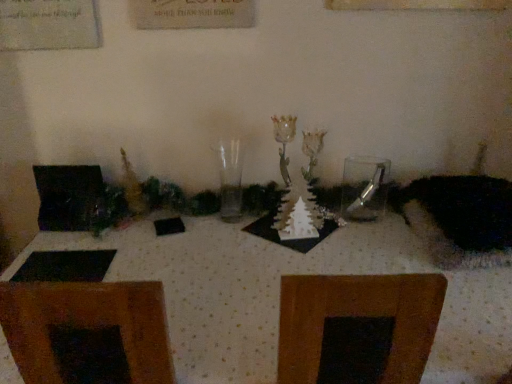
In order to click on transparent glass vase at center in this screenshot , I will do `click(230, 179)`.

Describe the element at coordinates (230, 179) in the screenshot. The width and height of the screenshot is (512, 384). I see `transparent glass vase at center` at that location.

What is the approximate height of fuzzy black cat at right?

It is 8.55 inches.

The height and width of the screenshot is (384, 512). Identify the location of white dotted fabric at center. click(234, 284).

Is clear glass spoon at center completely or partially outside of white dotted fabric at center?

Yes.

Is clear glass spoon at center in contact with white dotted fabric at center?

No, clear glass spoon at center is not touching white dotted fabric at center.

From the image's perspective, which is above, clear glass spoon at center or white dotted fabric at center?

Answer: clear glass spoon at center appears higher in the image.

Is transparent glass vase at center outside of clear glass spoon at center?

Yes, transparent glass vase at center is not within clear glass spoon at center.

Is transparent glass vase at center far from clear glass spoon at center?

transparent glass vase at center is near clear glass spoon at center, not far away.

Is transparent glass vase at center wider or thinner than clear glass spoon at center?

Considering their sizes, transparent glass vase at center looks broader than clear glass spoon at center.

What's the angular difference between fuzzy black cat at right and clear glass spoon at center's facing directions?

4.63 degrees.

Between point (478, 226) and point (361, 171), which one is positioned behind?

Point (361, 171)

From a real-world perspective, is fuzzy black cat at right below clear glass spoon at center?

Indeed, from a real-world perspective, fuzzy black cat at right is positioned beneath clear glass spoon at center.

Image resolution: width=512 pixels, height=384 pixels. Find the location of `table in front of the fuzzy black cat at right`. table in front of the fuzzy black cat at right is located at coordinates (234, 284).

From the image's perspective, which one is positioned lower, white dotted fabric at center or fuzzy black cat at right?

white dotted fabric at center is shown below in the image.

Considering the sizes of white dotted fabric at center and fuzzy black cat at right in the image, is white dotted fabric at center taller or shorter than fuzzy black cat at right?

Considering their sizes, white dotted fabric at center has more height than fuzzy black cat at right.

From a real-world perspective, is white dotted fabric at center on top of fuzzy black cat at right?

No, from a real-world perspective, white dotted fabric at center is not on top of fuzzy black cat at right.

Which of these two, white dotted fabric at center or clear glass spoon at center, is thinner?

clear glass spoon at center.

Would you consider white dotted fabric at center to be distant from clear glass spoon at center?

No, white dotted fabric at center is in close proximity to clear glass spoon at center.

Considering the points (61, 242) and (373, 193), which point is behind, point (61, 242) or point (373, 193)?

The point (373, 193) is behind.

How different are the orientations of fuzzy black cat at right and transparent glass vase at center in degrees?

They differ by 2.96 degrees in their facing directions.

Which of these two, fuzzy black cat at right or transparent glass vase at center, is thinner?

transparent glass vase at center is thinner.

Is fuzzy black cat at right not close to transparent glass vase at center?

No, fuzzy black cat at right is in close proximity to transparent glass vase at center.

Which is closer to the camera, (448, 228) or (219, 149)?

Point (448, 228) is positioned closer to the camera compared to point (219, 149).

From a real-world perspective, is white dotted fabric at center located beneath transparent glass vase at center?

Indeed, from a real-world perspective, white dotted fabric at center is positioned beneath transparent glass vase at center.

Which of these two, white dotted fabric at center or transparent glass vase at center, is thinner?

transparent glass vase at center is thinner.

This screenshot has width=512, height=384. Identify the location of candle holder on the left of white dotted fabric at center. (230, 179).

The height and width of the screenshot is (384, 512). Identify the location of table in front of the clear glass spoon at center. (234, 284).

What are the coordinates of `tableware behind the transparent glass vase at center` in the screenshot? It's located at (364, 188).

When comparing their distances from clear glass spoon at center, does white dotted fabric at center or transparent glass vase at center seem further?

transparent glass vase at center.

Looking at the image, which one is located closer to fuzzy black cat at right, clear glass spoon at center or white dotted fabric at center?

clear glass spoon at center is positioned closer to the anchor fuzzy black cat at right.

Consider the image. Which object lies further to the anchor point transparent glass vase at center, white dotted fabric at center or fuzzy black cat at right?

fuzzy black cat at right lies further to transparent glass vase at center than the other object.

When comparing their distances from fuzzy black cat at right, does clear glass spoon at center or transparent glass vase at center seem further?

Result: transparent glass vase at center is positioned further to the anchor fuzzy black cat at right.

Estimate the real-world distances between objects in this image. Which object is further from clear glass spoon at center, fuzzy black cat at right or transparent glass vase at center?

transparent glass vase at center is further to clear glass spoon at center.

Which object lies nearer to the anchor point white dotted fabric at center, transparent glass vase at center or clear glass spoon at center?

Based on the image, clear glass spoon at center appears to be nearer to white dotted fabric at center.

In the scene shown: Based on their spatial positions, is transparent glass vase at center or white dotted fabric at center further from clear glass spoon at center?

Based on the image, transparent glass vase at center appears to be further to clear glass spoon at center.

Estimate the real-world distances between objects in this image. Which object is further from clear glass spoon at center, white dotted fabric at center or fuzzy black cat at right?

white dotted fabric at center is positioned further to the anchor clear glass spoon at center.

Where is `table located between transparent glass vase at center and fuzzy black cat at right in the left-right direction`? This screenshot has height=384, width=512. table located between transparent glass vase at center and fuzzy black cat at right in the left-right direction is located at coordinates (234, 284).

Where is `tableware between white dotted fabric at center and fuzzy black cat at right`? The height and width of the screenshot is (384, 512). tableware between white dotted fabric at center and fuzzy black cat at right is located at coordinates point(364,188).

This screenshot has height=384, width=512. I want to click on tableware between transparent glass vase at center and white dotted fabric at center from top to bottom, so click(x=364, y=188).

Image resolution: width=512 pixels, height=384 pixels. I want to click on tableware located between transparent glass vase at center and fuzzy black cat at right in the left-right direction, so click(364, 188).